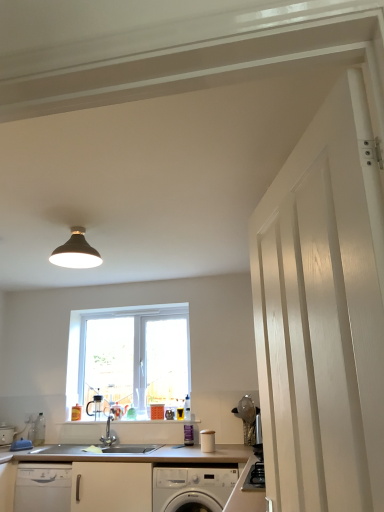
Question: Are white wood door at right and satin nickel faucet at center far apart?

Choices:
 (A) yes
 (B) no

Answer: (A)

Question: Considering the relative sizes of white wood door at right and satin nickel faucet at center in the image provided, is white wood door at right bigger than satin nickel faucet at center?

Choices:
 (A) yes
 (B) no

Answer: (A)

Question: Is white wood door at right to the right of satin nickel faucet at center from the viewer's perspective?

Choices:
 (A) yes
 (B) no

Answer: (A)

Question: Is white wood door at right wider than satin nickel faucet at center?

Choices:
 (A) no
 (B) yes

Answer: (A)

Question: Is white wood door at right oriented away from satin nickel faucet at center?

Choices:
 (A) yes
 (B) no

Answer: (B)

Question: Is white plastic window at center to the left or to the right of white wood door at right in the image?

Choices:
 (A) right
 (B) left

Answer: (B)

Question: From the image's perspective, is white plastic window at center positioned above or below white wood door at right?

Choices:
 (A) below
 (B) above

Answer: (A)

Question: Looking at their shapes, would you say white plastic window at center is wider or thinner than white wood door at right?

Choices:
 (A) thin
 (B) wide

Answer: (A)

Question: In terms of height, does white plastic window at center look taller or shorter compared to white wood door at right?

Choices:
 (A) short
 (B) tall

Answer: (A)

Question: From the image's perspective, relative to white plastic window at center, is white glossy washing machine at lower center above or below?

Choices:
 (A) above
 (B) below

Answer: (B)

Question: Is white glossy washing machine at lower center bigger or smaller than white plastic window at center?

Choices:
 (A) big
 (B) small

Answer: (A)

Question: From their relative heights in the image, would you say white glossy washing machine at lower center is taller or shorter than white plastic window at center?

Choices:
 (A) tall
 (B) short

Answer: (B)

Question: Considering the positions of white glossy washing machine at lower center and white plastic window at center in the image, is white glossy washing machine at lower center wider or thinner than white plastic window at center?

Choices:
 (A) thin
 (B) wide

Answer: (B)

Question: Is point (163, 396) closer or farther from the camera than point (231, 461)?

Choices:
 (A) farther
 (B) closer

Answer: (A)

Question: From their relative heights in the image, would you say white plastic window at center is taller or shorter than wooden countertop at lower left?

Choices:
 (A) short
 (B) tall

Answer: (B)